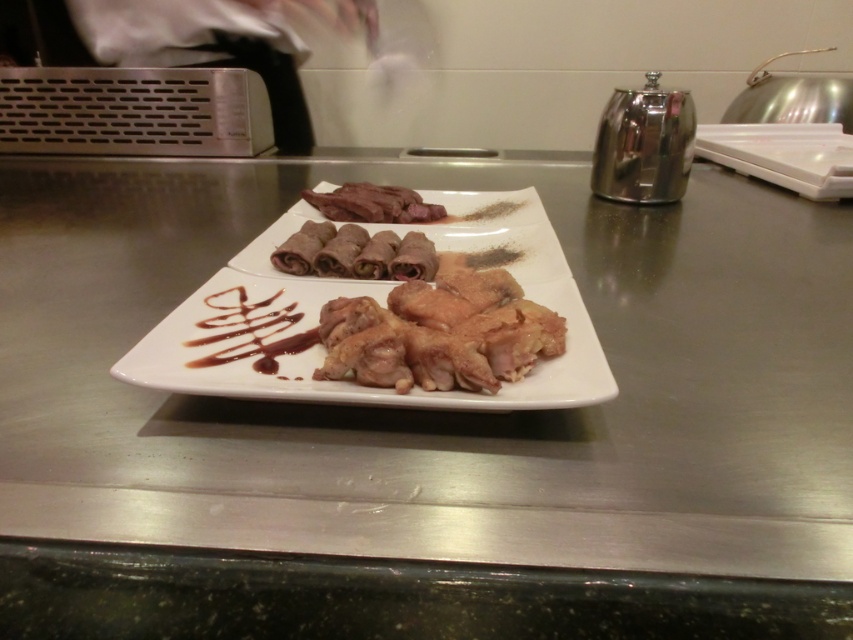
Which is more to the left, white glossy plate at center or golden brown crispy chicken at center?

From the viewer's perspective, white glossy plate at center appears more on the left side.

Is white glossy plate at center below golden brown crispy chicken at center?

Actually, white glossy plate at center is above golden brown crispy chicken at center.

Who is more forward, (254, 296) or (325, 376)?

Point (325, 376) is in front.

At what (x,y) coordinates should I click in order to perform the action: click on white glossy plate at center. Please return your answer as a coordinate pair (x, y). The width and height of the screenshot is (853, 640). Looking at the image, I should click on (380, 304).

Between point (566, 317) and point (434, 260), which one is positioned in front?

Point (566, 317) is in front.

Is point (456, 228) positioned in front of point (378, 230)?

No, (456, 228) is behind (378, 230).

This screenshot has width=853, height=640. In order to click on white glossy plate at center in this screenshot , I will do `click(380, 304)`.

Between golden brown crispy chicken at center and dark brown glossy meat at center, which one appears on the left side from the viewer's perspective?

dark brown glossy meat at center

Which is more to the right, golden brown crispy chicken at center or dark brown glossy meat at center?

golden brown crispy chicken at center

Which is behind, point (358, 365) or point (318, 209)?

Point (318, 209)

I want to click on golden brown crispy chicken at center, so click(440, 333).